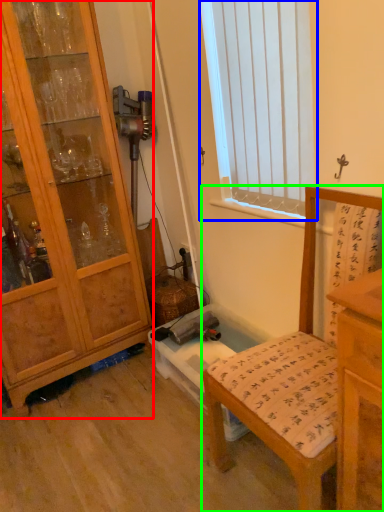
Question: Which is farther away from cabinetry (highlighted by a red box)? window (highlighted by a blue box) or chair (highlighted by a green box)?

Choices:
 (A) window
 (B) chair

Answer: (B)